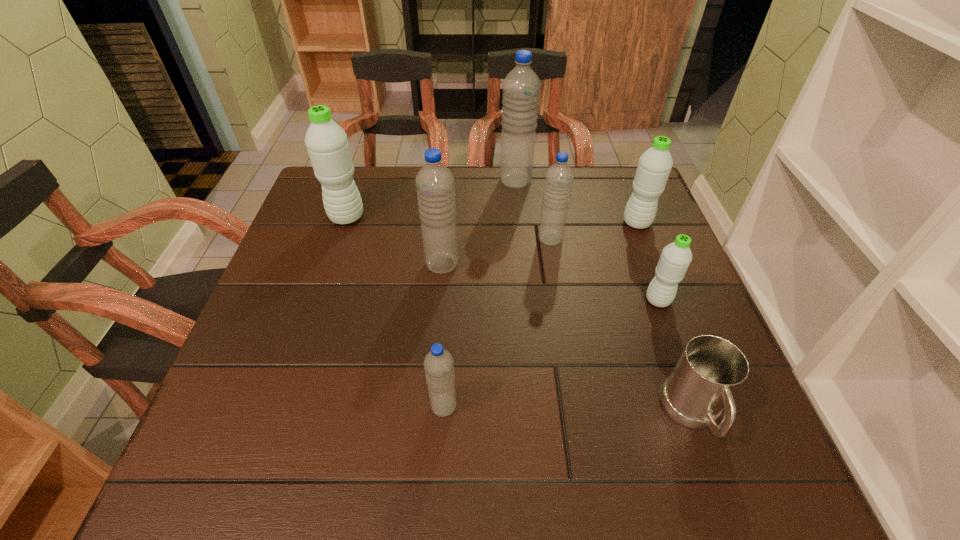
Find the location of a particular element. The image size is (960, 540). the farthest water bottle is located at coordinates (521, 87).

Identify the location of the tallest object. (521, 87).

Locate an element on the screen. the leftmost object is located at coordinates (327, 144).

Find the location of a particular element. This screenshot has height=540, width=960. the leftmost water bottle is located at coordinates (327, 144).

This screenshot has height=540, width=960. What are the coordinates of `the fifth farthest water bottle` in the screenshot? It's located at (435, 183).

Identify the location of the fourth nearest object. (435, 183).

Locate an element on the screen. This screenshot has height=540, width=960. the second biggest green water bottle is located at coordinates (654, 166).

Where is `the second smallest blue water bottle`? the second smallest blue water bottle is located at coordinates (559, 177).

Where is `the smallest green water bottle`? Image resolution: width=960 pixels, height=540 pixels. the smallest green water bottle is located at coordinates (676, 257).

Identify the location of the third nearest object. This screenshot has height=540, width=960. (676, 257).